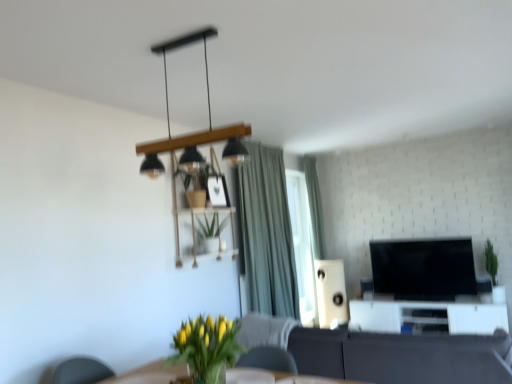
You are a GUI agent. You are given a task and a screenshot of the screen. Output one action in this format:
    pyautogui.click(x=<x>, y=<y>)
    Task: Click on the black glossy tv at center right
    
    Given the screenshot: What is the action you would take?
    pyautogui.click(x=423, y=268)

In order to click on white matte speaker at center-right in this screenshot , I will do `click(330, 292)`.

What is the approximate height of white matte speaker at center-right?

It is 1.01 meters.

The width and height of the screenshot is (512, 384). What do you see at coordinates (192, 142) in the screenshot?
I see `matte black pendant light at upper center` at bounding box center [192, 142].

What do you see at coordinates (399, 357) in the screenshot? The image size is (512, 384). I see `dark gray fabric couch at center` at bounding box center [399, 357].

I want to click on green matte plant at center, marked as the second houseplant in a front-to-back arrangement, so click(210, 233).

How different are the orientations of matte black pendant light at upper center and white glossy entertainment center at lower right in degrees?

179 degrees.

Is there a large distance between matte black pendant light at upper center and white glossy entertainment center at lower right?

matte black pendant light at upper center is far away from white glossy entertainment center at lower right.

Is matte black pendant light at upper center to the left of white glossy entertainment center at lower right from the viewer's perspective?

Yes, matte black pendant light at upper center is to the left of white glossy entertainment center at lower right.

Is matte black pendant light at upper center wider or thinner than black glossy tv at center right?

In the image, matte black pendant light at upper center appears to be wider than black glossy tv at center right.

From the image's perspective, between matte black pendant light at upper center and black glossy tv at center right, who is located below?

black glossy tv at center right.

Is matte black pendant light at upper center directly adjacent to black glossy tv at center right?

They are not placed beside each other.

Can you tell me how much dark gray fabric couch at center and white matte speaker at center-right differ in facing direction?

They differ by 180 degrees in their facing directions.

From a real-world perspective, who is located higher, dark gray fabric couch at center or white matte speaker at center-right?

white matte speaker at center-right.

Considering the relative sizes of dark gray fabric couch at center and white matte speaker at center-right in the image provided, is dark gray fabric couch at center thinner than white matte speaker at center-right?

No.

In the image, is yellow-green leafy plant at lower center, which is the 2th houseplant from back to front, on the left side or the right side of white matte speaker at center-right?

yellow-green leafy plant at lower center, which is the 2th houseplant from back to front, is positioned on white matte speaker at center-right's left side.

Consider the image. Does yellow-green leafy plant at lower center, placed as the 1th houseplant when sorted from bottom to top, have a smaller size compared to white matte speaker at center-right?

Indeed, yellow-green leafy plant at lower center, placed as the 1th houseplant when sorted from bottom to top, has a smaller size compared to white matte speaker at center-right.

Could you tell me if yellow-green leafy plant at lower center, placed as the 1th houseplant when sorted from bottom to top, is turned towards matte black pendant light at upper center?

No.

Is the depth of yellow-green leafy plant at lower center, placed as the 1th houseplant when sorted from bottom to top, less than that of matte black pendant light at upper center?

That is True.

Consider the image. Are yellow-green leafy plant at lower center, which is the 2th houseplant from back to front, and matte black pendant light at upper center far apart?

Yes.

Locate an element on the screen. The width and height of the screenshot is (512, 384). studio couch in front of the green fabric curtain at upper center is located at coordinates (399, 357).

From the image's perspective, which is below, green fabric curtain at upper center or dark gray fabric couch at center?

dark gray fabric couch at center appears lower in the image.

Is green fabric curtain at upper center taller than dark gray fabric couch at center?

Yes.

Visually, is green fabric curtain at upper center positioned to the left or to the right of dark gray fabric couch at center?

From the image, it's evident that green fabric curtain at upper center is to the left of dark gray fabric couch at center.

Find the location of a particular element. This screenshot has height=384, width=512. television that is above the white matte speaker at center-right (from a real-world perspective) is located at coordinates (x=423, y=268).

Is white matte speaker at center-right placed right next to black glossy tv at center right?

There is a gap between white matte speaker at center-right and black glossy tv at center right.

Is white matte speaker at center-right not within black glossy tv at center right?

white matte speaker at center-right is positioned outside black glossy tv at center right.

From the image's perspective, is white matte speaker at center-right located above black glossy tv at center right?

Actually, white matte speaker at center-right appears below black glossy tv at center right in the image.

Locate an element on the screen. entertainment center directly beneath the matte black pendant light at upper center (from a real-world perspective) is located at coordinates (426, 315).

What are the coordinates of `lamp on the left of black glossy tv at center right` in the screenshot? It's located at (192, 142).

Considering their positions, is matte black pendant light at upper center positioned further to green fabric curtain at upper center than green matte plant at center, the first houseplant from the back?

green matte plant at center, the first houseplant from the back, is positioned further to the anchor green fabric curtain at upper center.

From the image, which object appears to be nearer to yellow-green leafy plant at lower center, placed as the 1th houseplant when sorted from bottom to top, green matte plant at right or black glossy tv at center right?

black glossy tv at center right lies closer to yellow-green leafy plant at lower center, placed as the 1th houseplant when sorted from bottom to top, than the other object.

Based on their spatial positions, is yellow-green leafy plant at lower center, the second houseplant from the top, or black glossy tv at center right further from white matte speaker at center-right?

The object further to white matte speaker at center-right is yellow-green leafy plant at lower center, the second houseplant from the top.

From the image, which object appears to be nearer to white glossy entertainment center at lower right, dark gray fabric couch at center or green matte plant at right?

The object closer to white glossy entertainment center at lower right is green matte plant at right.

In the scene shown: Looking at the image, which one is located further to white matte speaker at center-right, dark gray fabric couch at center or black glossy tv at center right?

dark gray fabric couch at center.

Based on their spatial positions, is dark gray fabric couch at center or matte black pendant light at upper center closer to yellow-green leafy plant at lower center, the second houseplant from the top?

dark gray fabric couch at center is closer to yellow-green leafy plant at lower center, the second houseplant from the top.

From the image, which object appears to be nearer to black glossy tv at center right, matte black pendant light at upper center or green matte plant at right?

The object closer to black glossy tv at center right is green matte plant at right.

From the image, which object appears to be nearer to green matte plant at center, which is counted as the 1th houseplant, starting from the top, green matte plant at right or yellow-green leafy plant at lower center, which is the 2th houseplant from back to front?

yellow-green leafy plant at lower center, which is the 2th houseplant from back to front, lies closer to green matte plant at center, which is counted as the 1th houseplant, starting from the top, than the other object.

This screenshot has width=512, height=384. Identify the location of lamp between yellow-green leafy plant at lower center, the first houseplant positioned from the front, and white matte speaker at center-right, along the z-axis. (192, 142).

Where is `curtain located between yellow-green leafy plant at lower center, the first houseplant positioned from the front, and black glossy tv at center right in the depth direction`? This screenshot has width=512, height=384. curtain located between yellow-green leafy plant at lower center, the first houseplant positioned from the front, and black glossy tv at center right in the depth direction is located at coordinates (266, 234).

Where is `television between green matte plant at center, which is the 2th houseplant in bottom-to-top order, and green matte plant at right`? television between green matte plant at center, which is the 2th houseplant in bottom-to-top order, and green matte plant at right is located at coordinates (423, 268).

This screenshot has width=512, height=384. Find the location of `houseplant between yellow-green leafy plant at lower center, placed as the 1th houseplant when sorted from bottom to top, and white matte speaker at center-right from front to back`. houseplant between yellow-green leafy plant at lower center, placed as the 1th houseplant when sorted from bottom to top, and white matte speaker at center-right from front to back is located at coordinates (210, 233).